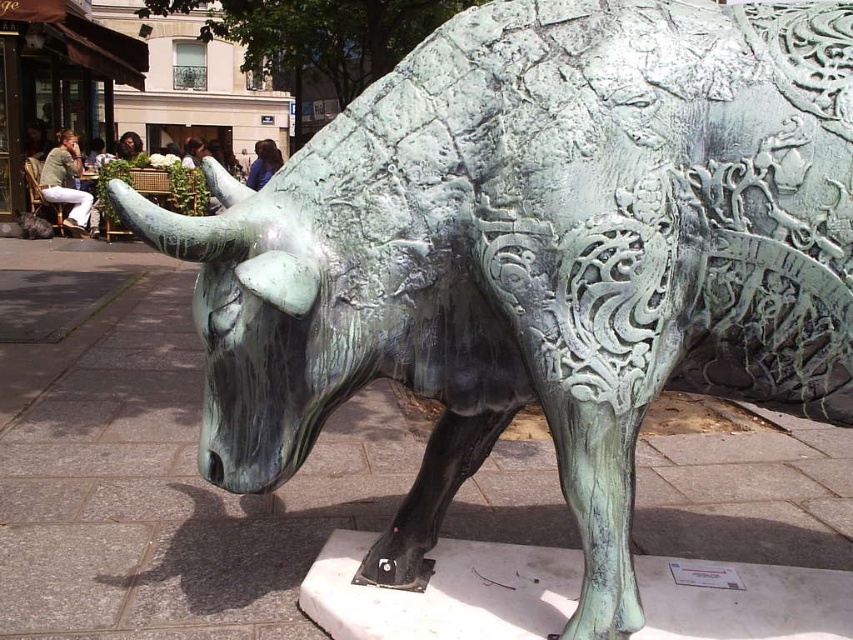
Question: Which is farther from the green cotton shirt at left?

Choices:
 (A) dark brown hair at upper center
 (B) blue fabric at center

Answer: (B)

Question: Is green cotton shirt at left bigger than dark brown hair at upper center?

Choices:
 (A) no
 (B) yes

Answer: (B)

Question: Is blue fabric at center bigger than dark brown hair at upper center?

Choices:
 (A) yes
 (B) no

Answer: (B)

Question: Which point is closer to the camera?

Choices:
 (A) (254, 180)
 (B) (120, 150)

Answer: (A)

Question: Which is farther from the blue fabric at center?

Choices:
 (A) dark brown hair at upper center
 (B) green cotton shirt at left

Answer: (B)

Question: Is blue fabric at center positioned behind dark brown hair at upper center?

Choices:
 (A) yes
 (B) no

Answer: (B)